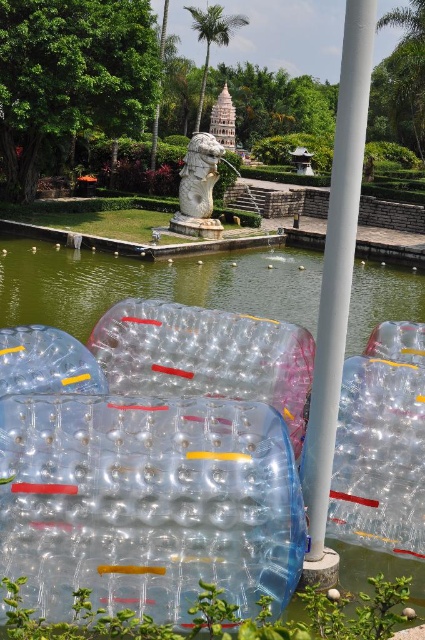
Question: Is transparent plastic water at center positioned before white smooth pole at center?

Choices:
 (A) yes
 (B) no

Answer: (B)

Question: Which object is closer to the camera taking this photo?

Choices:
 (A) white smooth pole at center
 (B) transparent plastic water at center

Answer: (A)

Question: Can you confirm if transparent plastic water at center is positioned to the right of white smooth pole at center?

Choices:
 (A) no
 (B) yes

Answer: (A)

Question: Does transparent plastic water at center have a greater width compared to white smooth pole at center?

Choices:
 (A) no
 (B) yes

Answer: (B)

Question: Which point appears closest to the camera in this image?

Choices:
 (A) (44, 282)
 (B) (331, 424)

Answer: (B)